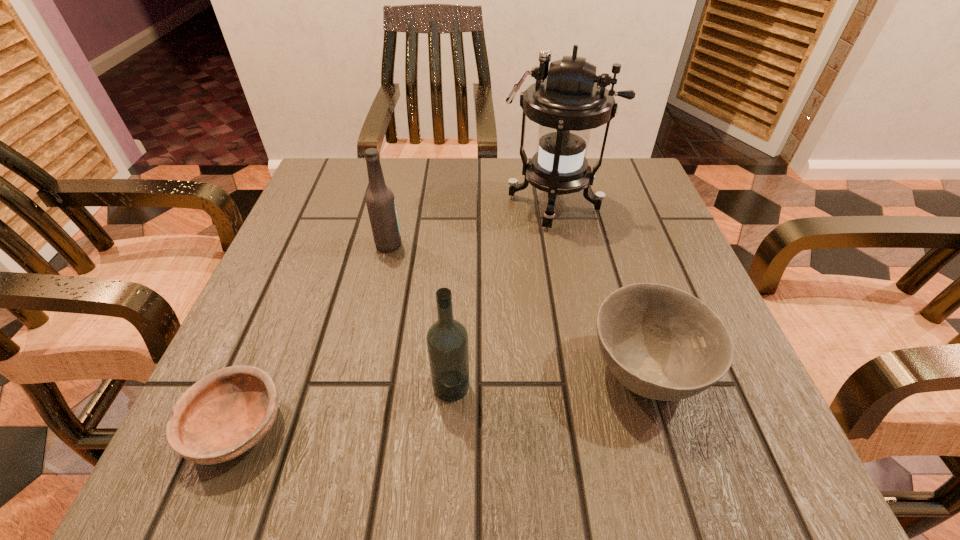
The height and width of the screenshot is (540, 960). In order to click on the tallest object in this screenshot , I will do `click(569, 100)`.

The width and height of the screenshot is (960, 540). I want to click on lantern, so click(x=569, y=100).

The image size is (960, 540). Identify the location of beer bottle. (380, 201).

Image resolution: width=960 pixels, height=540 pixels. In order to click on the fourth nearest object in this screenshot , I will do `click(380, 201)`.

Locate an element on the screen. vodka is located at coordinates (447, 340).

The width and height of the screenshot is (960, 540). I want to click on the right bowl, so click(662, 343).

I want to click on the taller bowl, so click(662, 343).

Identify the location of the leftmost object. (226, 413).

This screenshot has width=960, height=540. I want to click on the shorter bowl, so click(x=226, y=413).

Where is `vacant region located on the back of the lantern`? vacant region located on the back of the lantern is located at coordinates 546,167.